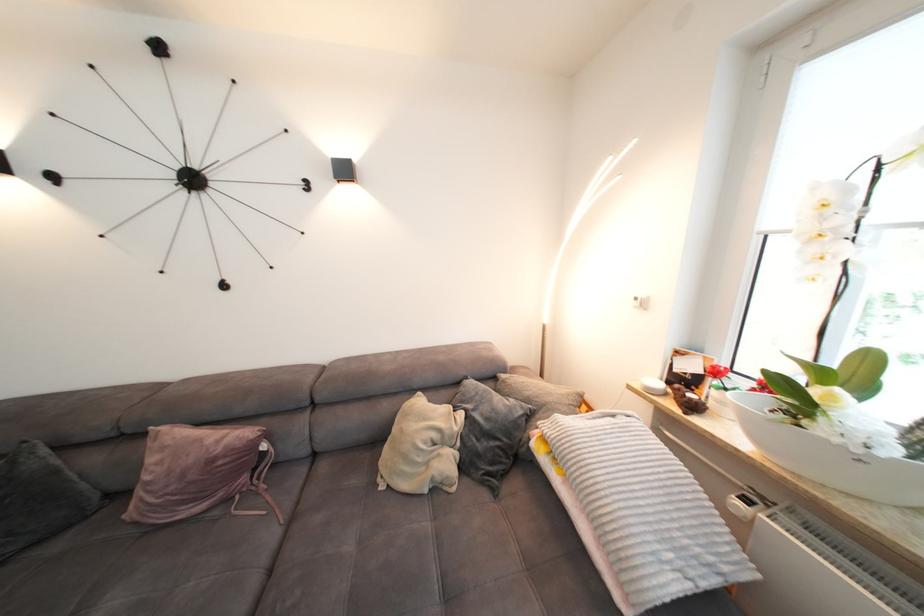
Image resolution: width=924 pixels, height=616 pixels. What are the coordinates of `white plant bowl` in the screenshot? It's located at 825,456.